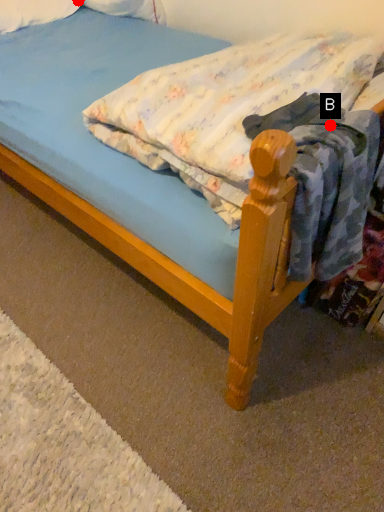
Question: Two points are circled on the image, labeled by A and B beside each circle. Which point is closer to the camera?

Choices:
 (A) A is closer
 (B) B is closer

Answer: (B)